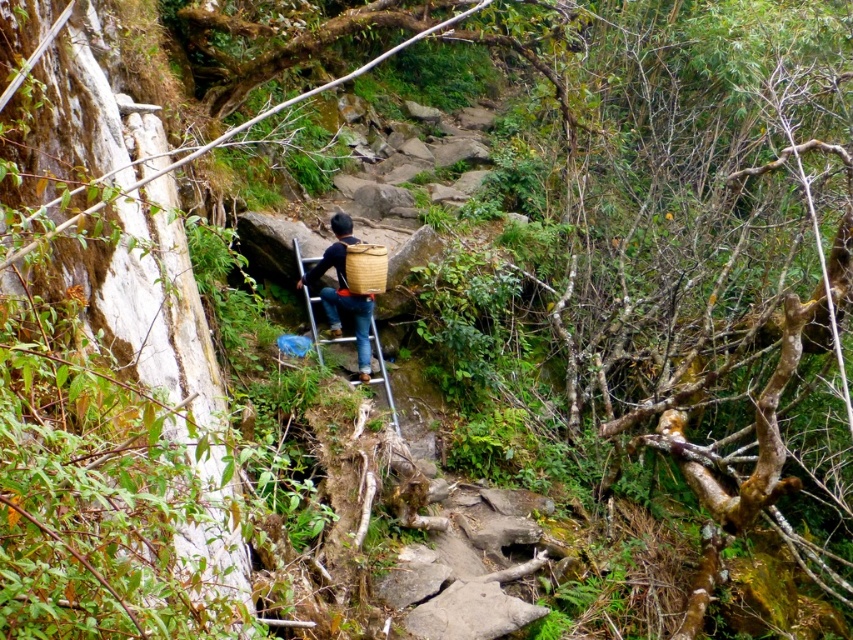
Is brown woven basket at center in front of woven bamboo basket at center?

No, brown woven basket at center is behind woven bamboo basket at center.

Measure the distance between brown woven basket at center and woven bamboo basket at center.

brown woven basket at center is 27.96 centimeters away from woven bamboo basket at center.

The image size is (853, 640). What do you see at coordinates (343, 292) in the screenshot? I see `brown woven basket at center` at bounding box center [343, 292].

Identify the location of brown woven basket at center. This screenshot has width=853, height=640. (343, 292).

Consider the image. Which is more to the right, metallic silver ladder at center or woven bamboo basket at center?

woven bamboo basket at center is more to the right.

Consider the image. Who is taller, metallic silver ladder at center or woven bamboo basket at center?

metallic silver ladder at center is taller.

At what (x,y) coordinates should I click in order to perform the action: click on metallic silver ladder at center. Please return your answer as a coordinate pair (x, y). Looking at the image, I should click on (350, 340).

Who is positioned more to the left, brown woven basket at center or metallic silver ladder at center?

brown woven basket at center is more to the left.

Does point (306, 282) come farther from viewer compared to point (328, 333)?

No, it is in front of (328, 333).

Between point (366, 326) and point (358, 328), which one is positioned in front?

Point (358, 328)

At what (x,y) coordinates should I click in order to perform the action: click on brown woven basket at center. Please return your answer as a coordinate pair (x, y). This screenshot has width=853, height=640. Looking at the image, I should click on (343, 292).